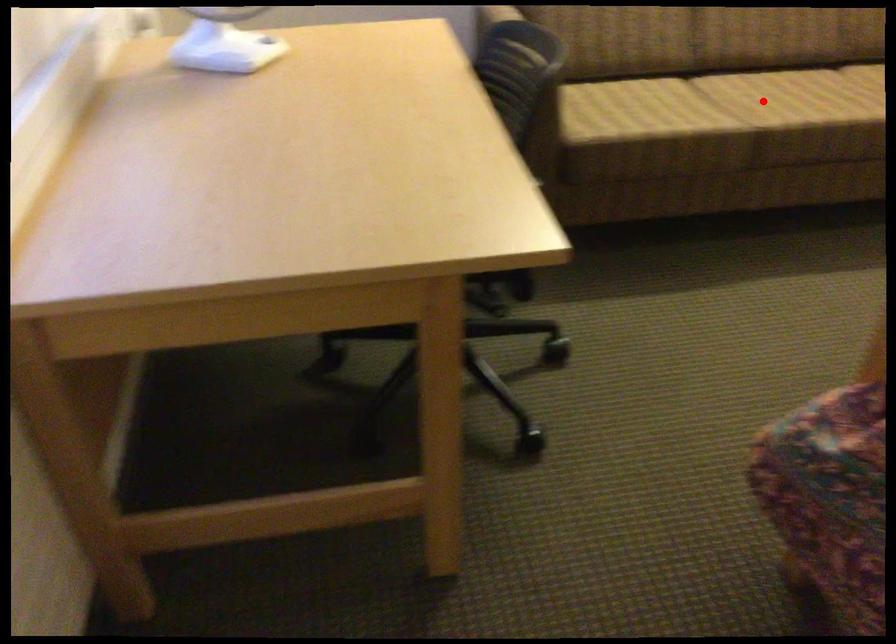
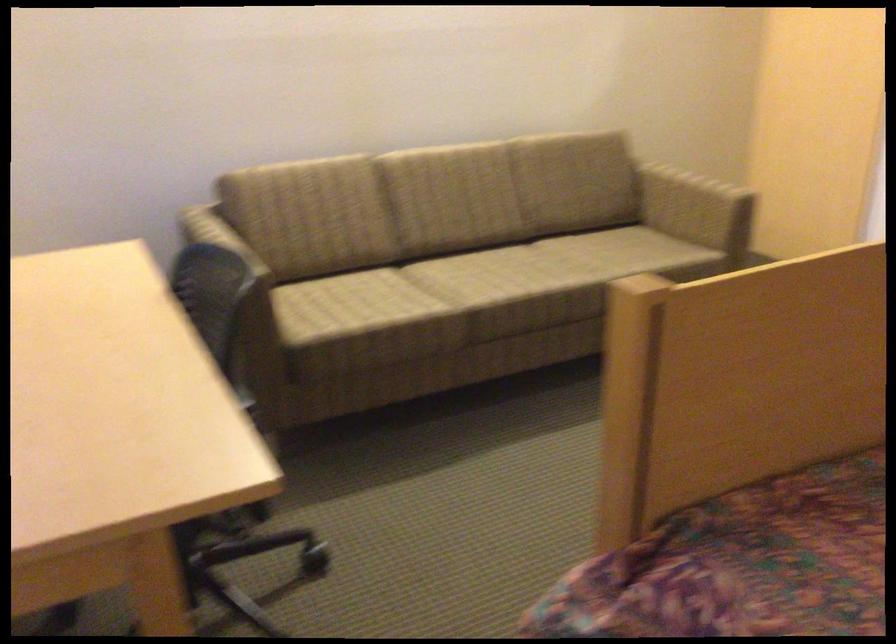
Locate, in the second image, the point that corresponds to the highlighted location in the first image.

(470, 279)